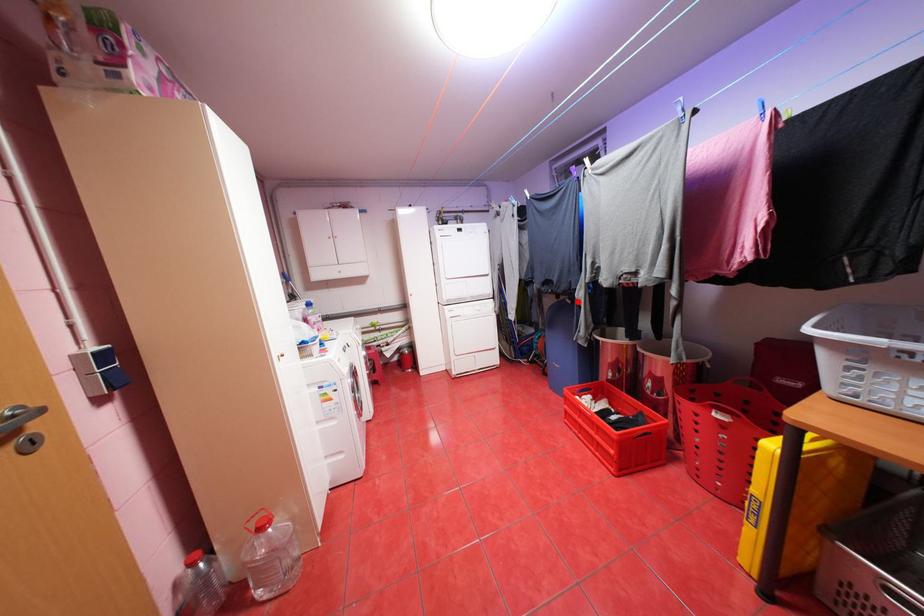
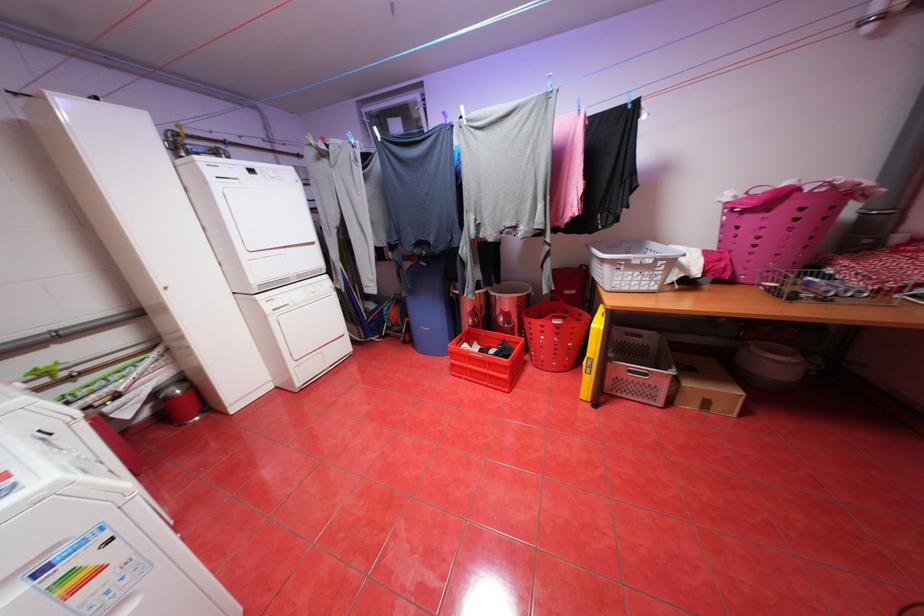
Locate, in the second image, the point that corresponds to the highlighted location in the first image.

(433, 264)